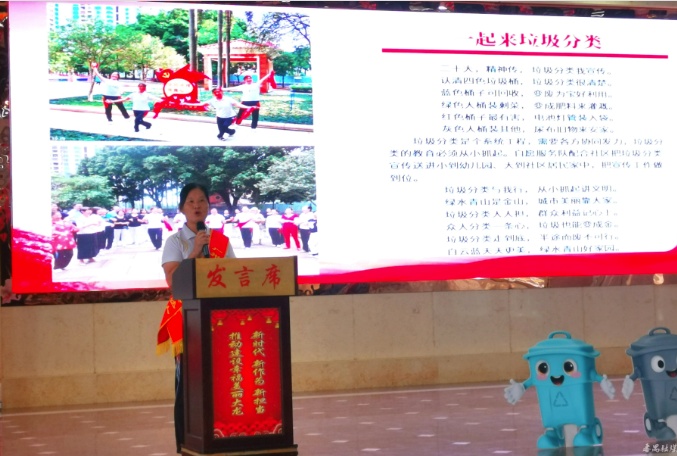
Locate an element on the screen. granite patterned flooring is located at coordinates (397, 435), (87, 439).